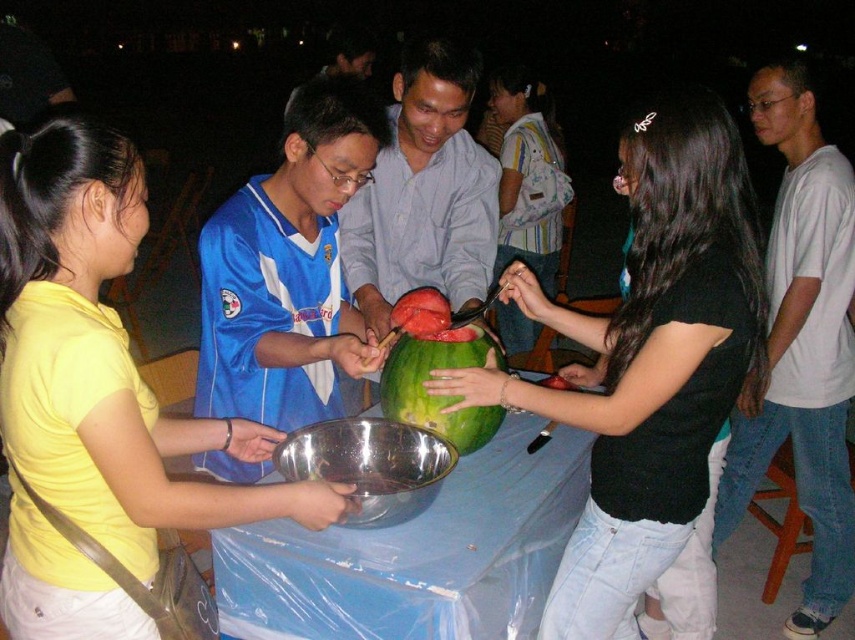
Question: From the image, what is the correct spatial relationship of yellow matte shirt at left in relation to green matte watermelon at center?

Choices:
 (A) left
 (B) right

Answer: (A)

Question: Which point is farther to the camera?

Choices:
 (A) (417, 616)
 (B) (479, 353)
 (C) (81, 289)

Answer: (B)

Question: Considering the relative positions of yellow matte shirt at left and green matte watermelon at center in the image provided, where is yellow matte shirt at left located with respect to green matte watermelon at center?

Choices:
 (A) left
 (B) right

Answer: (A)

Question: Does blue plastic table at center lie in front of green matte watermelon at center?

Choices:
 (A) yes
 (B) no

Answer: (A)

Question: Which point is farther to the camera?

Choices:
 (A) (144, 180)
 (B) (603, 394)

Answer: (B)

Question: Which point is farther to the camera?

Choices:
 (A) (405, 352)
 (B) (207, 490)
 (C) (671, 106)
 (D) (516, 436)

Answer: (D)